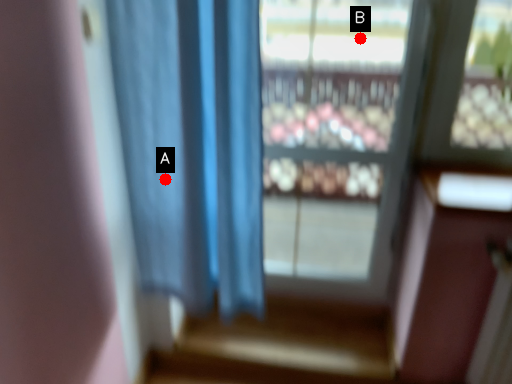
Question: Two points are circled on the image, labeled by A and B beside each circle. Among these points, which one is farthest from the camera?

Choices:
 (A) A is further
 (B) B is further

Answer: (B)